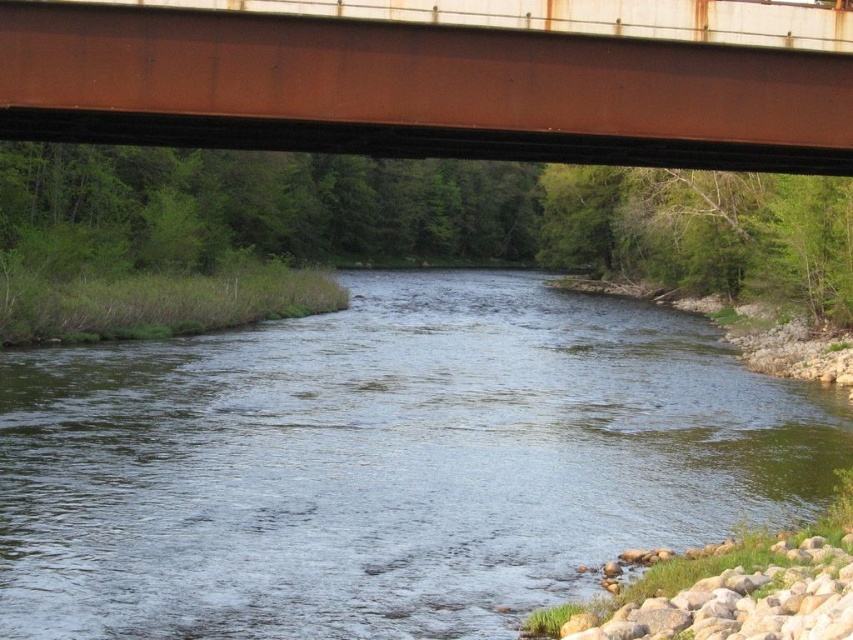
Question: Can you confirm if clear water at center is positioned to the left of rusty metal bridge at upper center?

Choices:
 (A) yes
 (B) no

Answer: (B)

Question: Which object appears farthest from the camera in this image?

Choices:
 (A) rusty metal bridge at upper center
 (B) clear water at center

Answer: (B)

Question: Does clear water at center have a larger size compared to rusty metal bridge at upper center?

Choices:
 (A) yes
 (B) no

Answer: (A)

Question: Can you confirm if clear water at center is thinner than rusty metal bridge at upper center?

Choices:
 (A) no
 (B) yes

Answer: (A)